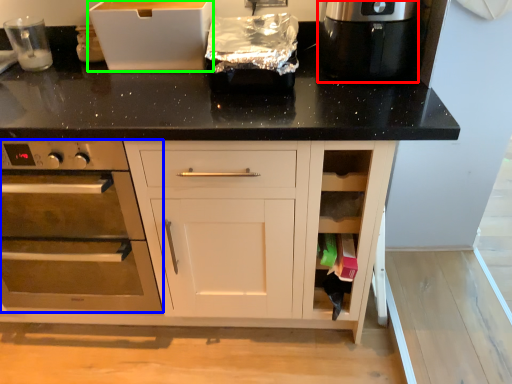
Question: Estimate the real-world distances between objects in this image. Which object is farther from kitchen appliance (highlighted by a red box), home appliance (highlighted by a blue box) or cardboard box (highlighted by a green box)?

Choices:
 (A) home appliance
 (B) cardboard box

Answer: (A)